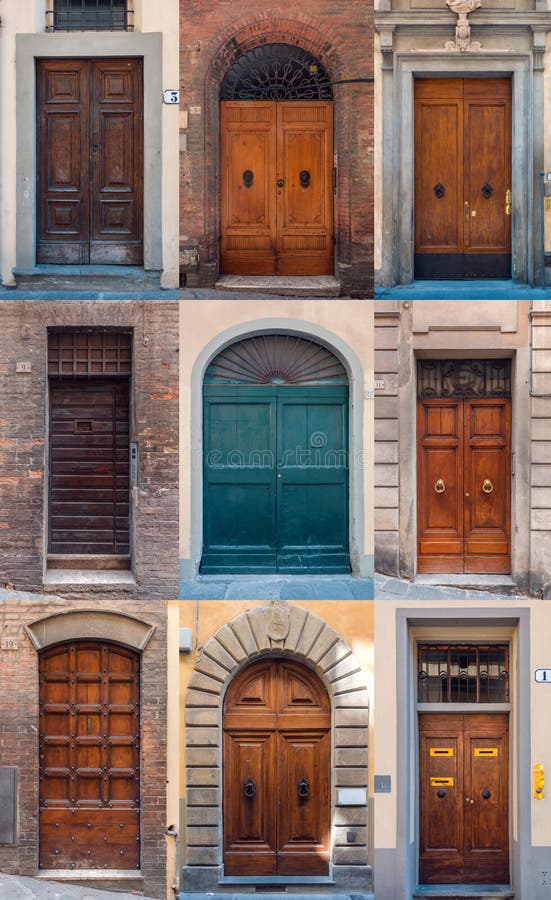
Identify the location of door knockers. This screenshot has height=900, width=551. (249, 793), (306, 796), (442, 793), (486, 794), (489, 482), (440, 484), (306, 176), (249, 178), (441, 187), (489, 192).